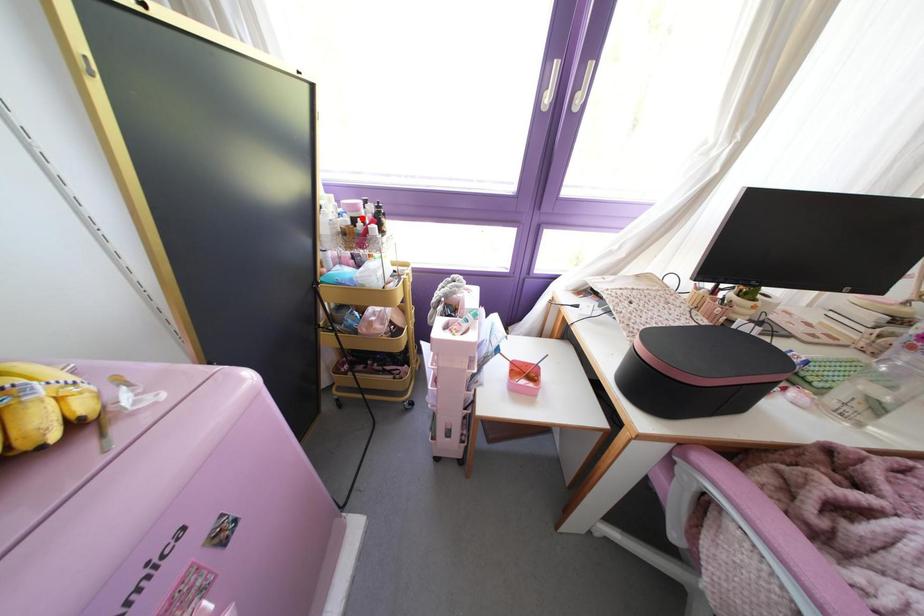
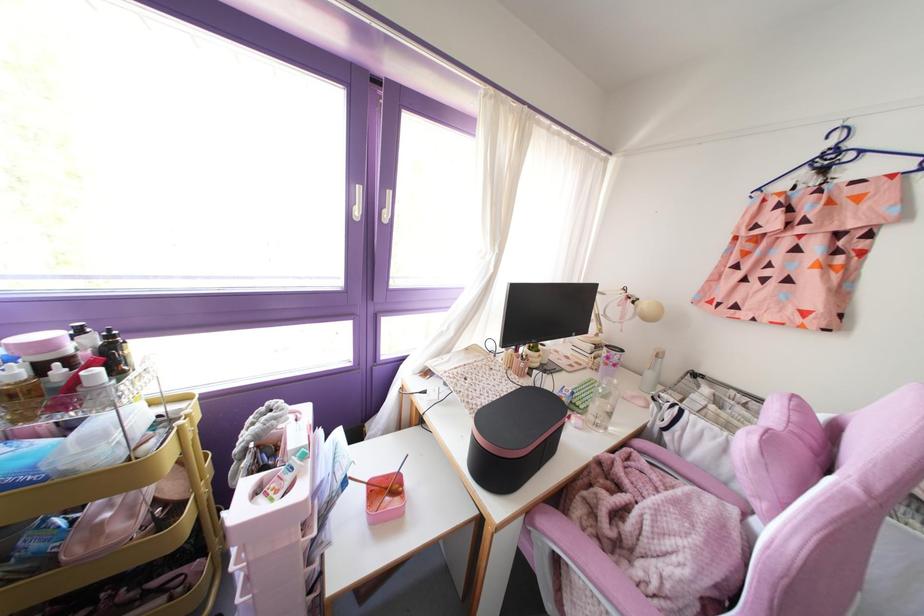
Locate, in the second image, the point that corresponds to the highlighted location in the first image.

(67, 360)